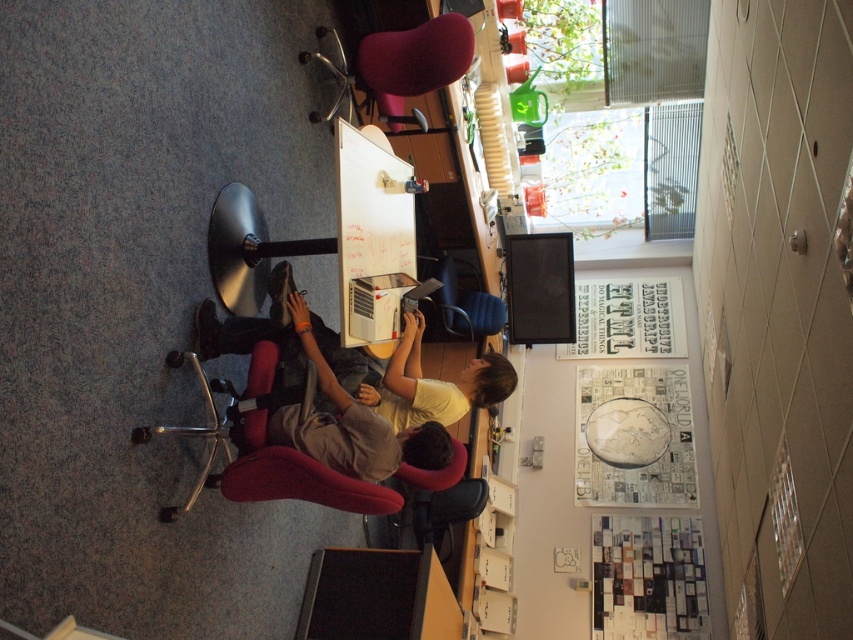
From the picture: You are a delivery person who needs to place a large package on the desk. The package is 1.2 meters wide. There are two chairs in the way of the desk space where you want to place the package. The chairs are the velvet red swivel chair at upper center and the blue fabric chair at center. Which chair should you move to create enough space for the package, considering their widths?

The velvet red swivel chair at upper center has a greater width than the blue fabric chair at center. To create enough space for the 1.2 meter wide package, you should move the wider velvet red swivel chair at upper center first since it occupies more space.

From the picture: You are a delivery person who needs to place a package on the desk in the workspace. The package must be placed precisely at the coordinates provided. Where should you place the package relative to the velvet red swivel chair at upper center?

The package should be placed at the coordinates point (403, 65), which is the exact location of the velvet red swivel chair at upper center.